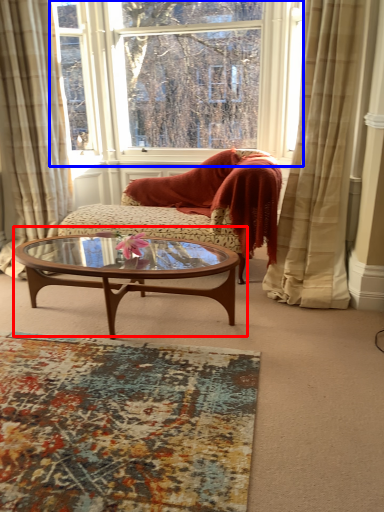
Question: Which object appears farthest to the camera in this image, coffee table (highlighted by a red box) or window (highlighted by a blue box)?

Choices:
 (A) coffee table
 (B) window

Answer: (B)